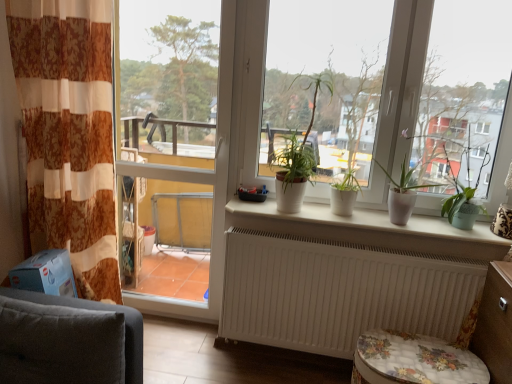
Question: From a real-world perspective, is white matte pot at center, marked as the second houseplant in a right-to-left arrangement, physically located above or below dark gray fabric armchair at lower left?

Choices:
 (A) above
 (B) below

Answer: (A)

Question: Is white matte pot at center, marked as the second houseplant in a right-to-left arrangement, to the left or to the right of dark gray fabric armchair at lower left in the image?

Choices:
 (A) right
 (B) left

Answer: (A)

Question: Estimate the real-world distances between objects in this image. Which object is closer to the floral fabric music stool at lower right?

Choices:
 (A) white matte pot at center, which is the 2th houseplant from left to right
 (B) green matte plant at right
 (C) dark gray fabric armchair at lower left
 (D) white matte pot at center, the first houseplant from the right
 (E) white matte plant pot at center, marked as the third houseplant in a right-to-left arrangement

Answer: (D)

Question: Estimate the real-world distances between objects in this image. Which object is closer to the brown floral fabric curtain at left?

Choices:
 (A) white matte window at center
 (B) white matte radiator at lower center
 (C) white ceramic plant pots at center
 (D) green matte plant at right
 (E) floral fabric music stool at lower right

Answer: (C)